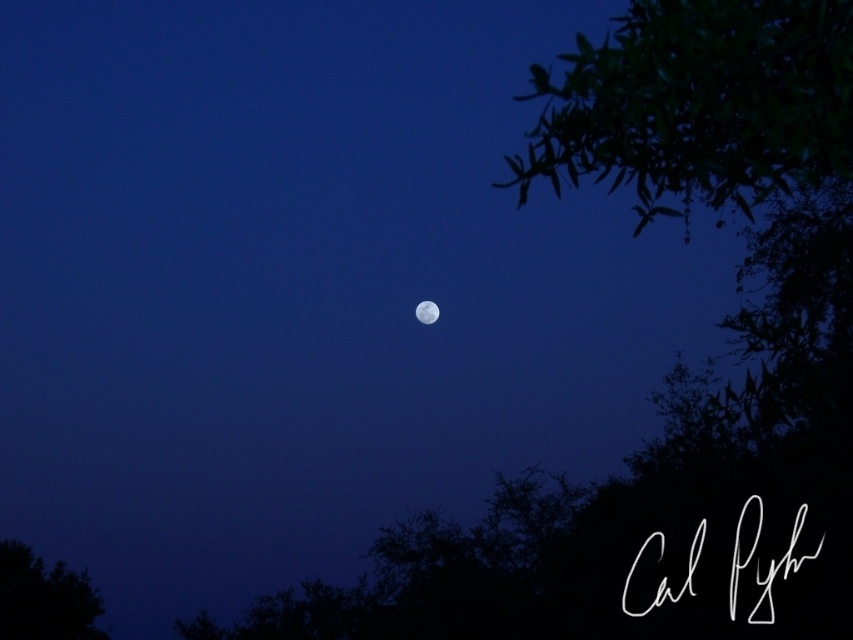
Can you confirm if green leafy branches at upper right is bigger than green leafy tree at lower left?

Correct, green leafy branches at upper right is larger in size than green leafy tree at lower left.

Which of these two, green leafy branches at upper right or green leafy tree at lower left, stands shorter?

green leafy tree at lower left

Where is `green leafy branches at upper right`? This screenshot has height=640, width=853. green leafy branches at upper right is located at coordinates (699, 104).

Locate an element on the screen. green leafy branches at upper right is located at coordinates (699, 104).

Between green leafy branches at upper right and white reflective moon at center, which one has more height?

With more height is green leafy branches at upper right.

Between point (811, 90) and point (415, 312), which one is positioned in front?

Point (811, 90)

Is point (752, 188) positioned after point (437, 317)?

No, (752, 188) is in front of (437, 317).

At what (x,y) coordinates should I click in order to perform the action: click on green leafy branches at upper right. Please return your answer as a coordinate pair (x, y). This screenshot has width=853, height=640. Looking at the image, I should click on (699, 104).

Can you confirm if green leafy tree at lower left is positioned to the left of white reflective moon at center?

Indeed, green leafy tree at lower left is positioned on the left side of white reflective moon at center.

Is point (64, 609) positioned before point (419, 316)?

No, (64, 609) is behind (419, 316).

Find the location of a particular element. This screenshot has height=640, width=853. green leafy tree at lower left is located at coordinates (44, 596).